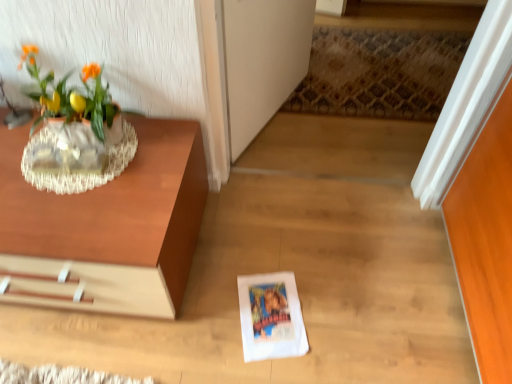
Locate an element on the screen. This screenshot has height=384, width=512. blank space situated above white paper at center (from a real-world perspective) is located at coordinates (268, 316).